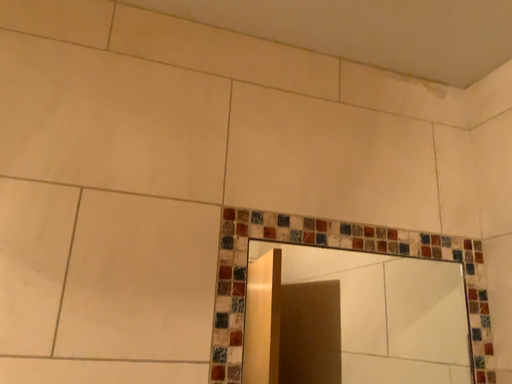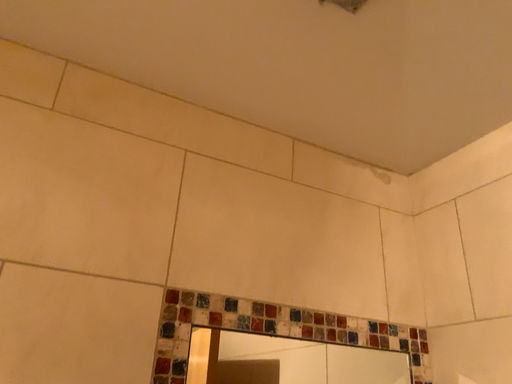
Question: How did the camera likely rotate when shooting the video?

Choices:
 (A) rotated left
 (B) rotated right

Answer: (B)